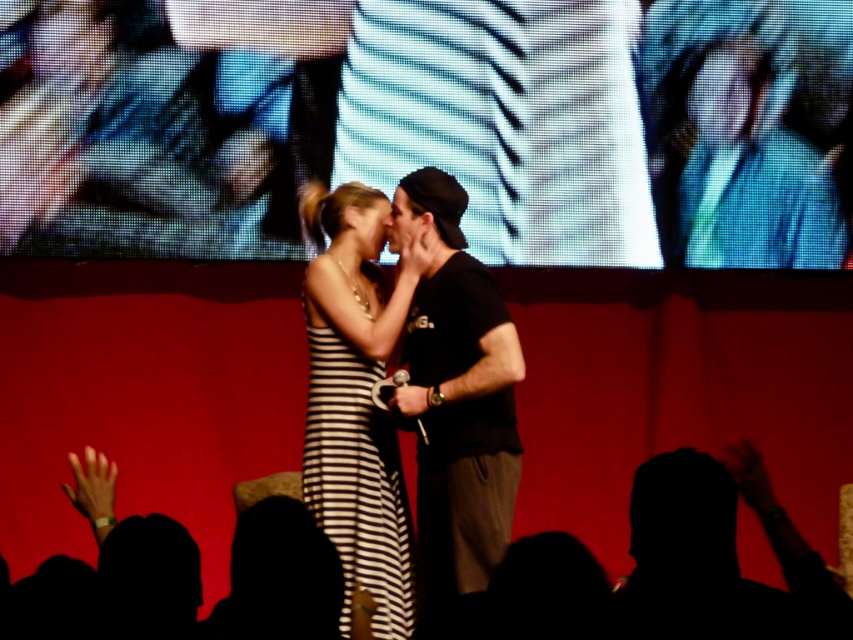
You are a photographer positioned at the front of the stage. You want to capture a closeup shot of the black striped dress at center without including the large screen in the background. Based on the dress location at point 0.750, 0.420, is this possible?

The black striped dress at center is located at point (357, 480), so if the photographer adjusts their camera angle to focus on that coordinate while avoiding the background screen, it should be possible to capture the closeup without including the screen.

You are a stagehand who needs to place a spotlight exactly at the center of the black striped dress at center. According to the coordinates provided, where should you aim the spotlight?

The spotlight should be aimed at the coordinates point (357, 480), which is the 2D location of the black striped dress at center.